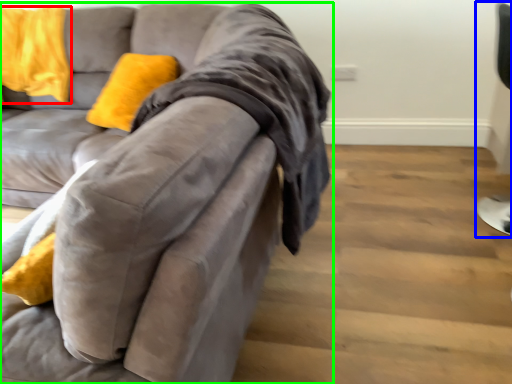
Question: Estimate the real-world distances between objects in this image. Which object is closer to pillow (highlighted by a red box), computer chair (highlighted by a blue box) or studio couch (highlighted by a green box)?

Choices:
 (A) computer chair
 (B) studio couch

Answer: (B)